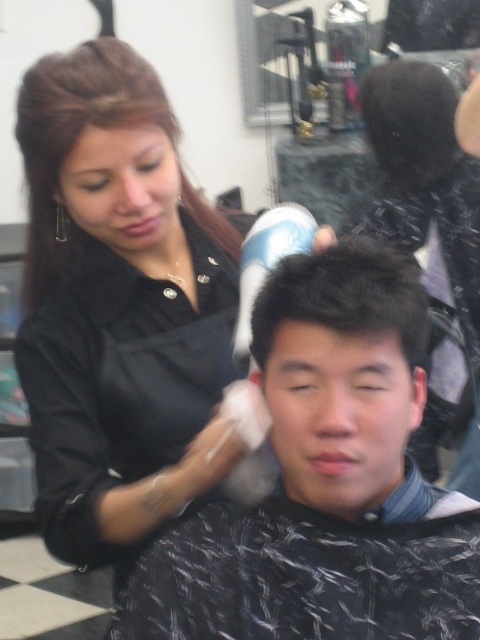
Does black matte hair dryer at upper center have a smaller size compared to black matte hair clip at upper left?

Incorrect, black matte hair dryer at upper center is not smaller in size than black matte hair clip at upper left.

Which is more to the left, black matte hair dryer at upper center or black matte hair clip at upper left?

Positioned to the left is black matte hair clip at upper left.

What do you see at coordinates (119, 307) in the screenshot? The width and height of the screenshot is (480, 640). I see `black matte hair dryer at upper center` at bounding box center [119, 307].

In order to click on black matte hair dryer at upper center in this screenshot , I will do `click(119, 307)`.

Between black matte hair dryer at upper center and smooth black hair at center, which one is positioned higher?

smooth black hair at center

What do you see at coordinates (119, 307) in the screenshot? I see `black matte hair dryer at upper center` at bounding box center [119, 307].

Between point (144, 205) and point (448, 394), which one is positioned behind?

The point (448, 394) is more distant.

I want to click on black matte hair dryer at upper center, so [119, 307].

Looking at this image, who is higher up, black matte hair dryer at upper center or black matte hair at upper center?

black matte hair at upper center

What do you see at coordinates (119, 307) in the screenshot? I see `black matte hair dryer at upper center` at bounding box center [119, 307].

Which is behind, point (195, 200) or point (375, 134)?

Point (375, 134)

The image size is (480, 640). Identify the location of black matte hair dryer at upper center. (119, 307).